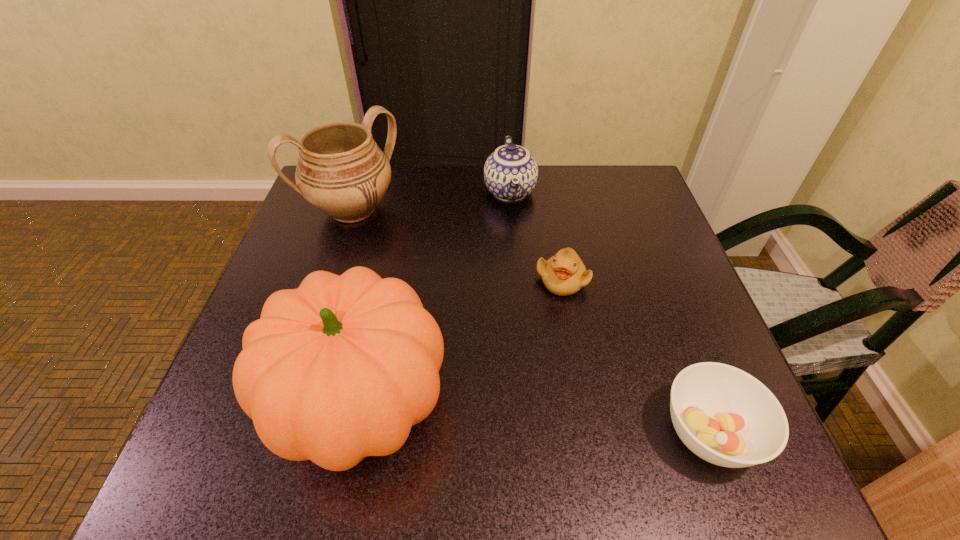
This screenshot has width=960, height=540. What are the coordinates of `free spot on the desktop that is between the pumpkin and the soup bowl and is positioned on the front-facing side of the duckling` in the screenshot? It's located at (550, 420).

This screenshot has width=960, height=540. Identify the location of free space on the desktop that is between the pumpkin and the soup bowl and is positioned at the spout of the third shortest object. (543, 419).

The height and width of the screenshot is (540, 960). I want to click on vacant space on the desktop that is between the pumpkin and the soup bowl and is positioned on the front-facing side of the urn, so click(x=537, y=418).